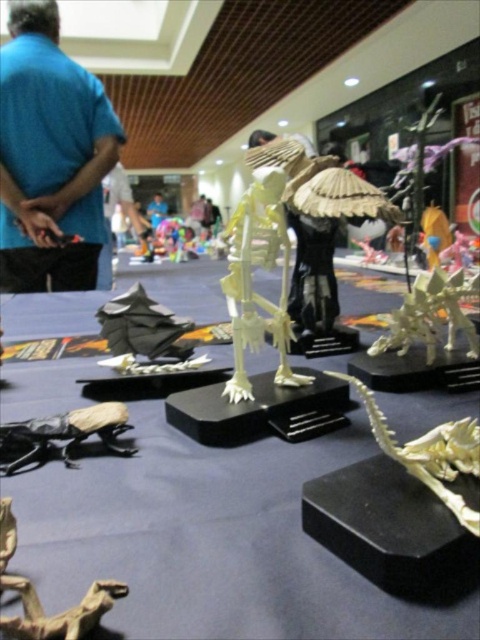
You are standing at the origin of the coordinate system in the image. You want to reach the point at the bottom of the table where the two points are located. Which point should you go to first, point (239,244) or point (22,436)?

You should go to point (22,436) first because it is closer to you than point (239,244), which is further away.

You are an attendee at the origami exhibition and you see the blue fabric shirt at upper left and the matte black beetle at lower left. Which object is positioned higher up in the image?

The blue fabric shirt at upper left is positioned higher up in the image than the matte black beetle at lower left.